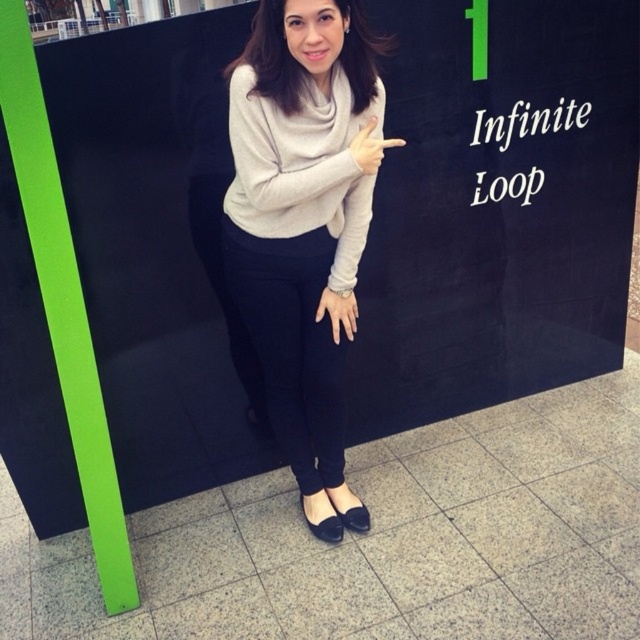
You are a fashion designer observing the person in the image. You need to decide which item is wider between the matte gray sweater at center and the matte white ring at center. Which one is wider?

The matte gray sweater at center is wider than the matte white ring at center according to the description.

You are a drone operator trying to navigate between two points marked on a map. The first point is at coordinates point (x=332, y=312) and the second point is at coordinates point (x=372, y=160). According to the scene, which point is further away from the observer?

Point (x=332, y=312) is behind point (x=372, y=160), so it is further away from the observer.

You are an observer looking at the scene. The person is pointing at the wall text. Can you tell me which object is positioned lower between the matte gray sweater at center and the matte gray finger at upper center?

The matte gray sweater at center is positioned below the matte gray finger at upper center, so the sweater is lower than the finger.